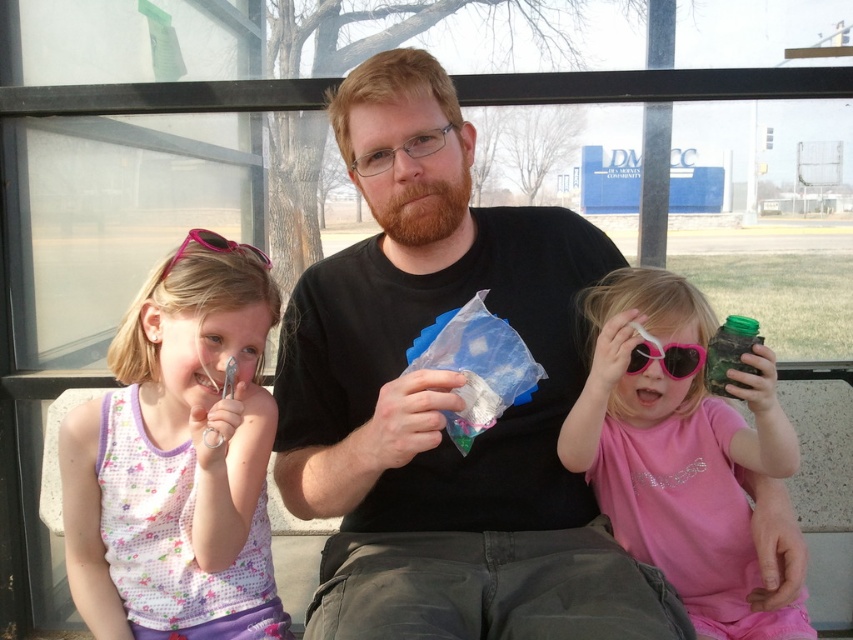
Does black matte shirt at center have a larger size compared to pink plastic goggles at center?

Yes, black matte shirt at center is bigger than pink plastic goggles at center.

Between point (450, 509) and point (688, 362), which one is positioned behind?

Point (450, 509)

Does point (363, 392) lie in front of point (647, 364)?

No, (363, 392) is behind (647, 364).

The height and width of the screenshot is (640, 853). Find the location of `black matte shirt at center`. black matte shirt at center is located at coordinates (444, 400).

Does pink fabric dress at left come in front of pink plastic goggles at upper left?

Yes, it is.

Which of these two, pink fabric dress at left or pink plastic goggles at upper left, stands taller?

Standing taller between the two is pink fabric dress at left.

Who is more forward, (100, 520) or (218, 243)?

Positioned in front is point (218, 243).

Where is `pink fabric dress at left`? This screenshot has height=640, width=853. pink fabric dress at left is located at coordinates (178, 460).

Does pink fabric dress at left appear on the left side of pink plastic goggles at center?

Yes, pink fabric dress at left is to the left of pink plastic goggles at center.

In the scene shown: Between pink fabric dress at left and pink plastic goggles at center, which one is positioned higher?

Positioned higher is pink plastic goggles at center.

Between point (157, 490) and point (637, 355), which one is positioned in front?

Point (637, 355) is in front.

Image resolution: width=853 pixels, height=640 pixels. In order to click on pink fabric dress at left in this screenshot , I will do `click(178, 460)`.